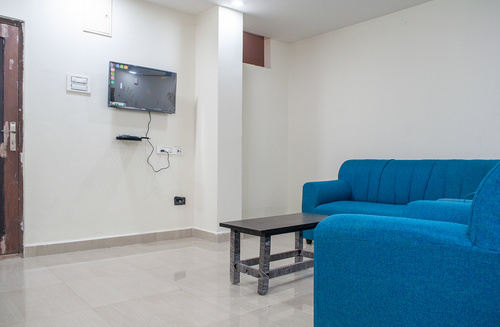
Locate an element on the screen. wall is located at coordinates (397, 97), (280, 106), (79, 130).